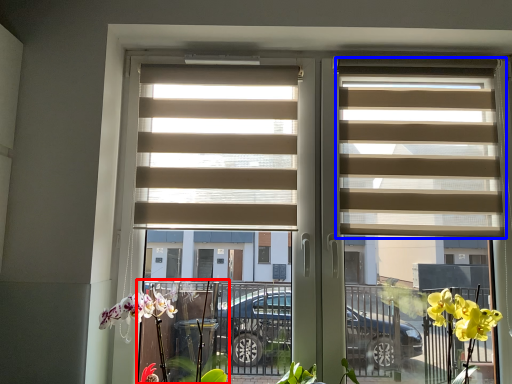
Question: Among these objects, which one is nearest to the camera, plant (highlighted by a red box) or window blind (highlighted by a blue box)?

Choices:
 (A) plant
 (B) window blind

Answer: (A)